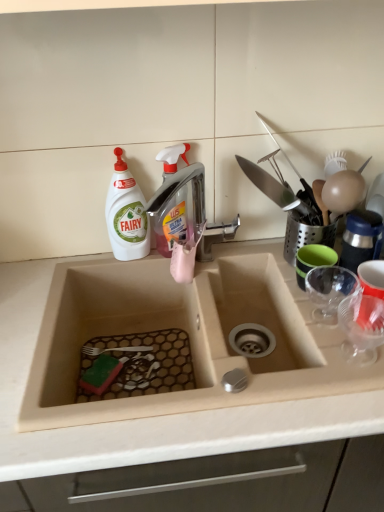
Question: From a real-world perspective, is metallic silver faucet at upper center located higher than beige matte sink at center?

Choices:
 (A) yes
 (B) no

Answer: (A)

Question: Is metallic silver faucet at upper center closer to camera compared to beige matte sink at center?

Choices:
 (A) yes
 (B) no

Answer: (B)

Question: Considering the relative sizes of metallic silver faucet at upper center and beige matte sink at center in the image provided, is metallic silver faucet at upper center taller than beige matte sink at center?

Choices:
 (A) yes
 (B) no

Answer: (A)

Question: Does metallic silver faucet at upper center have a greater width compared to beige matte sink at center?

Choices:
 (A) no
 (B) yes

Answer: (A)

Question: Is metallic silver faucet at upper center bigger than beige matte sink at center?

Choices:
 (A) no
 (B) yes

Answer: (A)

Question: Can you see metallic silver faucet at upper center touching beige matte sink at center?

Choices:
 (A) yes
 (B) no

Answer: (B)

Question: Can you confirm if transparent plastic cup at right, placed as the 2th tableware when sorted from front to back, is smaller than translucent plastic spray bottle at center, which is counted as the first cleaning product, starting from the right?

Choices:
 (A) no
 (B) yes

Answer: (A)

Question: Can you confirm if transparent plastic cup at right, placed as the 2th tableware when sorted from front to back, is positioned to the left of translucent plastic spray bottle at center, which is counted as the first cleaning product, starting from the right?

Choices:
 (A) yes
 (B) no

Answer: (B)

Question: Could translucent plastic spray bottle at center, which is counted as the first cleaning product, starting from the right, be considered to be inside transparent plastic cup at right, the 2th tableware positioned from the back?

Choices:
 (A) yes
 (B) no

Answer: (B)

Question: From the image's perspective, would you say transparent plastic cup at right, placed as the 2th tableware when sorted from front to back, is positioned over translucent plastic spray bottle at center, which is the 2th cleaning product in left-to-right order?

Choices:
 (A) no
 (B) yes

Answer: (A)

Question: Would you say transparent plastic cup at right, the 2th tableware positioned from the back, is a long distance from translucent plastic spray bottle at center, which is the 2th cleaning product in left-to-right order?

Choices:
 (A) yes
 (B) no

Answer: (B)

Question: Considering the relative sizes of transparent plastic cup at right, the 2th tableware positioned from the back, and translucent plastic spray bottle at center, which is the 2th cleaning product in left-to-right order, in the image provided, is transparent plastic cup at right, the 2th tableware positioned from the back, thinner than translucent plastic spray bottle at center, which is the 2th cleaning product in left-to-right order,?

Choices:
 (A) no
 (B) yes

Answer: (A)

Question: Is transparent plastic cup at right, the 2th tableware positioned from the back, looking in the opposite direction of green rubber cup at right, which appears as the first tableware when viewed from the back?

Choices:
 (A) yes
 (B) no

Answer: (B)